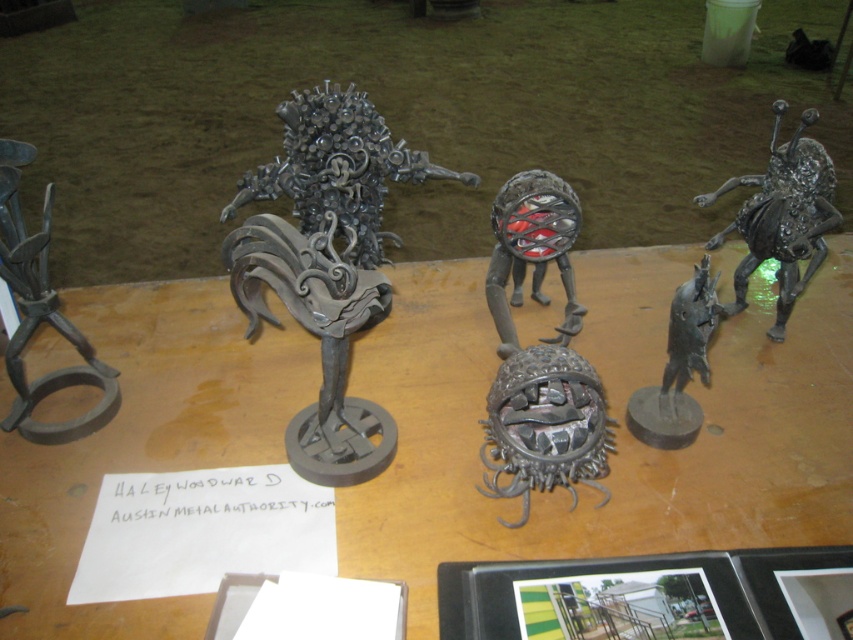
Who is taller, metallic gray sculpture at center or matte black metal sphere at center?

Standing taller between the two is metallic gray sculpture at center.

Can you confirm if metallic gray sculpture at center is smaller than matte black metal sphere at center?

Actually, metallic gray sculpture at center might be larger than matte black metal sphere at center.

Is point (840, 252) positioned behind point (535, 280)?

Yes.

The image size is (853, 640). I want to click on metallic gray sculpture at center, so [614, 428].

Which of these two, metallic gray sculpture at center or metallic sculpture at center, stands shorter?

metallic gray sculpture at center

Which is above, metallic gray sculpture at center or metallic sculpture at center?

metallic sculpture at center is above.

The height and width of the screenshot is (640, 853). What do you see at coordinates (614, 428) in the screenshot? I see `metallic gray sculpture at center` at bounding box center [614, 428].

Identify the location of metallic gray sculpture at center. (614, 428).

Between dark gray metal/iron at left and matte black horse at right, which one appears on the right side from the viewer's perspective?

matte black horse at right

Is dark gray metal/iron at left below matte black horse at right?

Incorrect, dark gray metal/iron at left is not positioned below matte black horse at right.

The width and height of the screenshot is (853, 640). Identify the location of dark gray metal/iron at left. (41, 314).